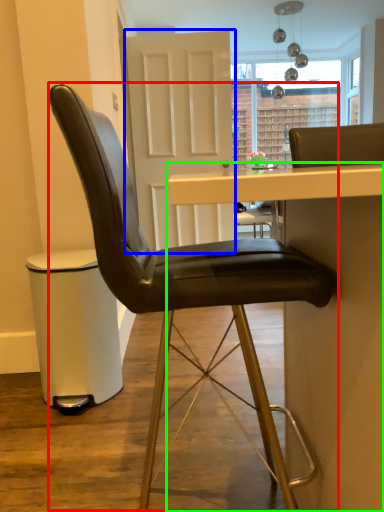
Question: Which object is positioned farthest from chair (highlighted by a red box)? Select from glass door (highlighted by a blue box) and table (highlighted by a green box).

Choices:
 (A) glass door
 (B) table

Answer: (A)